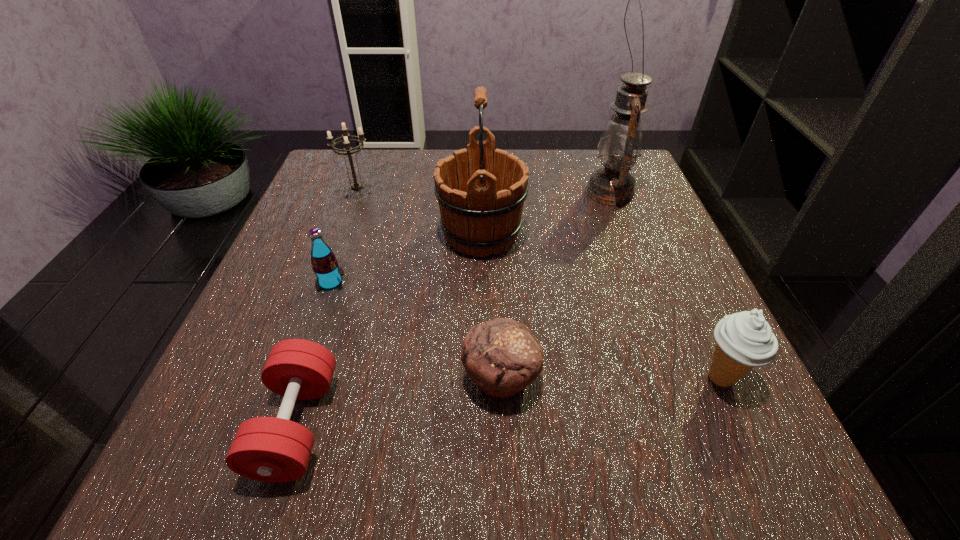
Where is `free space that satisfies the following two spatial constraints: 1. on the back side of the tallest object; 2. on the right side of the dumbbell`? This screenshot has width=960, height=540. free space that satisfies the following two spatial constraints: 1. on the back side of the tallest object; 2. on the right side of the dumbbell is located at coordinates (371, 192).

Image resolution: width=960 pixels, height=540 pixels. Identify the location of free space that satisfies the following two spatial constraints: 1. on the front side of the fourth nearest object; 2. on the left side of the dumbbell. (281, 424).